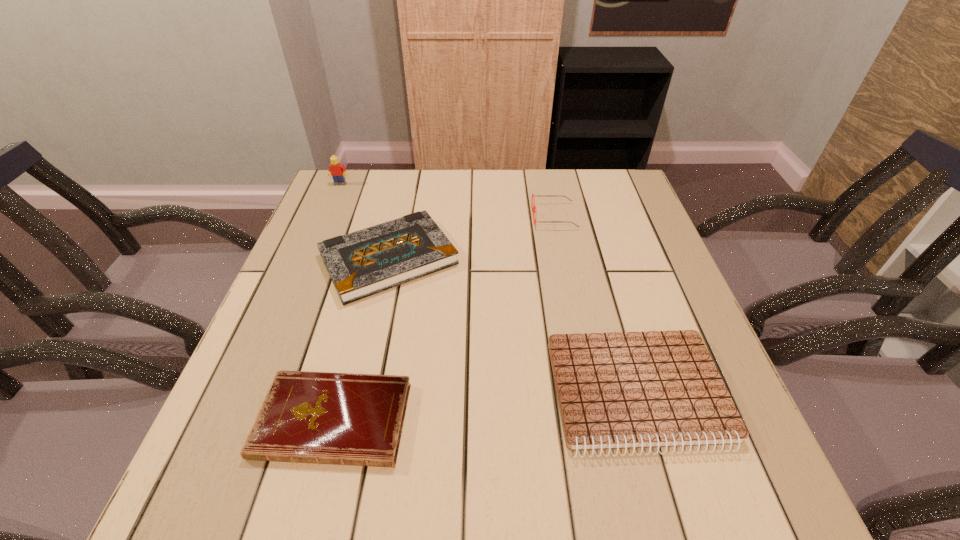
Locate an element on the screen. The height and width of the screenshot is (540, 960). object located at the near right corner is located at coordinates click(619, 390).

The image size is (960, 540). In the image, there is a desktop. In order to click on vacant space at the far edge in this screenshot , I will do click(386, 173).

In the image, there is a desktop. What are the coordinates of `vacant space at the left edge` in the screenshot? It's located at (312, 216).

Identify the location of blank space at the right edge of the desktop. (650, 311).

Image resolution: width=960 pixels, height=540 pixels. I want to click on vacant space at the far left corner of the desktop, so click(x=356, y=200).

This screenshot has height=540, width=960. I want to click on free space at the near left corner of the desktop, so click(x=237, y=478).

Identify the location of vacant area at the far right corner. (608, 206).

This screenshot has width=960, height=540. I want to click on free point between the spectacles and the tallest notebook, so click(x=471, y=238).

In order to click on empty location between the spectacles and the farthest notebook in this screenshot , I will do `click(471, 238)`.

Where is `vacant area between the tallest notebook and the second tallest notebook`? This screenshot has width=960, height=540. vacant area between the tallest notebook and the second tallest notebook is located at coordinates (513, 326).